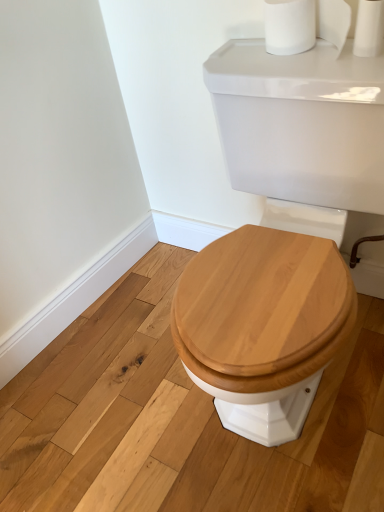
Where is `vacant space situated on the left part of white matte toilet paper at upper right`? Image resolution: width=384 pixels, height=512 pixels. vacant space situated on the left part of white matte toilet paper at upper right is located at coordinates (293, 62).